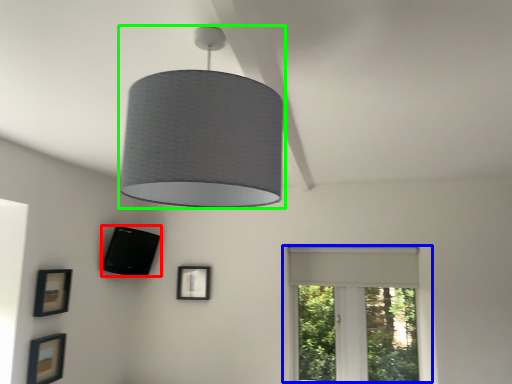
Question: Considering the real-world distances, which object is closest to picture frame (highlighted by a red box)? window (highlighted by a blue box) or lamp (highlighted by a green box).

Choices:
 (A) window
 (B) lamp

Answer: (A)